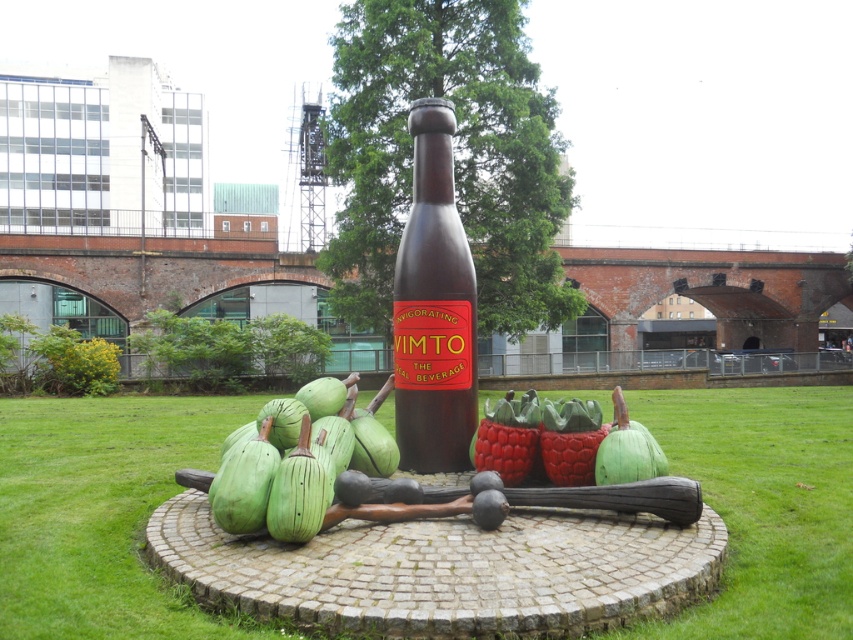
You are an art student visiting the park and see the green wood fruit at center and the green matte squash at lower left. Which one is positioned to the right of the other?

The green wood fruit at center is positioned to the right of the green matte squash at lower left.

You are an artist planning to paint this scene. You need to know which of the two green objects, the green wood fruit at center or the green matte squash at lower left, is taller to ensure proper proportions in your painting. Which one is taller?

The green wood fruit at center is taller than the green matte squash at lower left according to the description.